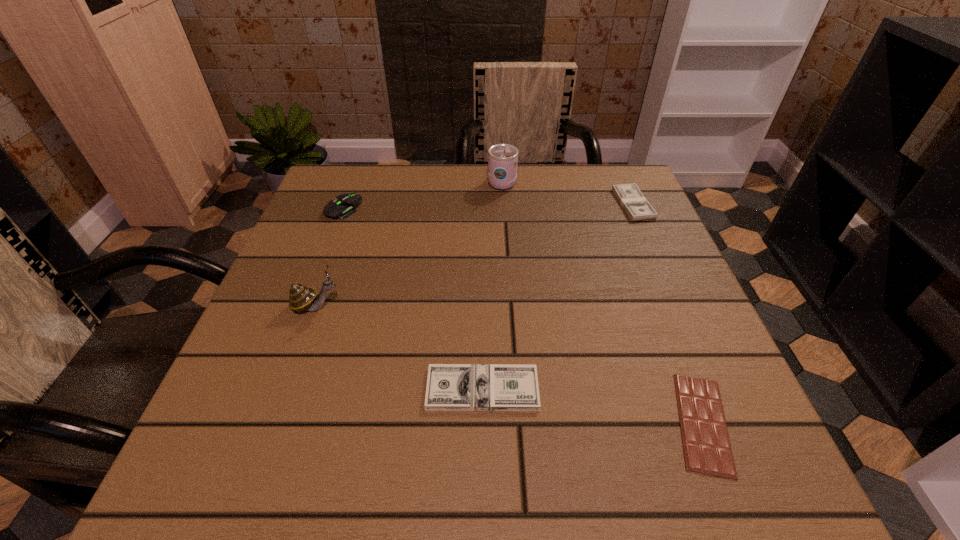
The image size is (960, 540). I want to click on vacant space that is in between the third tallest object and the cup, so click(x=422, y=195).

Where is `free area in between the snail and the third shortest object`? The width and height of the screenshot is (960, 540). free area in between the snail and the third shortest object is located at coordinates (474, 255).

Identify the location of vacant point located between the farther dollar and the fifth shortest object. This screenshot has height=540, width=960. (474, 255).

Locate an element on the screen. free spot between the snail and the tallest object is located at coordinates (409, 244).

Image resolution: width=960 pixels, height=540 pixels. Find the location of `free space that is in between the snail and the right dollar`. free space that is in between the snail and the right dollar is located at coordinates (474, 255).

Image resolution: width=960 pixels, height=540 pixels. I want to click on free space between the cup and the farther dollar, so click(567, 193).

The image size is (960, 540). Find the location of `blank region between the fourth tallest object and the third tallest object`. blank region between the fourth tallest object and the third tallest object is located at coordinates (488, 206).

I want to click on free spot between the computer mouse and the cup, so click(x=422, y=195).

The height and width of the screenshot is (540, 960). I want to click on free spot between the computer mouse and the nearer dollar, so click(x=413, y=299).

Locate an element on the screen. vacant area that lies between the nearer dollar and the chocolate bar is located at coordinates (592, 406).